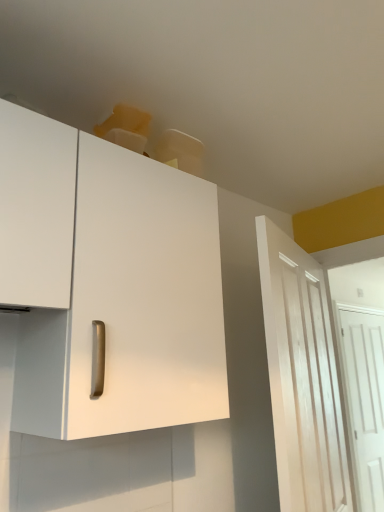
Question: From a real-world perspective, is white matte cabinet at upper left on top of white wooden door at right, which is the 2th door from front to back?

Choices:
 (A) yes
 (B) no

Answer: (A)

Question: Does white matte cabinet at upper left have a greater height compared to white wooden door at right, which is counted as the 1th door, starting from the back?

Choices:
 (A) yes
 (B) no

Answer: (B)

Question: Is white wooden door at right, the second door viewed from the left, at the back of white matte cabinet at upper left?

Choices:
 (A) yes
 (B) no

Answer: (B)

Question: Is white matte cabinet at upper left beside white wooden door at right, which is counted as the 1th door, starting from the back?

Choices:
 (A) no
 (B) yes

Answer: (A)

Question: Considering the relative sizes of white matte cabinet at upper left and white wooden door at right, which is counted as the 1th door, starting from the back, in the image provided, is white matte cabinet at upper left thinner than white wooden door at right, which is counted as the 1th door, starting from the back,?

Choices:
 (A) no
 (B) yes

Answer: (A)

Question: Based on their positions, is white wooden door at right, which is counted as the 1th door, starting from the back, located to the left or right of white wood door at right, the 1th door when ordered from front to back?

Choices:
 (A) left
 (B) right

Answer: (B)

Question: Looking at their shapes, would you say white wooden door at right, which is counted as the 1th door, starting from the back, is wider or thinner than white wood door at right, the 1th door when ordered from front to back?

Choices:
 (A) wide
 (B) thin

Answer: (B)

Question: Is point (375, 385) positioned closer to the camera than point (292, 307)?

Choices:
 (A) farther
 (B) closer

Answer: (A)

Question: Is white wooden door at right, which is counted as the 1th door, starting from the back, inside or outside of white wood door at right, which ranks as the 1th door in left-to-right order?

Choices:
 (A) outside
 (B) inside

Answer: (A)

Question: In terms of size, does white wood door at right, which is counted as the 2th door, starting from the back, appear bigger or smaller than white matte cabinet at upper left?

Choices:
 (A) small
 (B) big

Answer: (A)

Question: From a real-world perspective, is white wood door at right, marked as the 2th door in a right-to-left arrangement, physically located above or below white matte cabinet at upper left?

Choices:
 (A) above
 (B) below

Answer: (B)

Question: In the image, is white wood door at right, which ranks as the 1th door in left-to-right order, positioned in front of or behind white matte cabinet at upper left?

Choices:
 (A) behind
 (B) front

Answer: (A)

Question: From the image's perspective, is white wood door at right, which is counted as the 2th door, starting from the back, positioned above or below white matte cabinet at upper left?

Choices:
 (A) below
 (B) above

Answer: (A)

Question: In the image, is white wood door at right, which is counted as the 2th door, starting from the back, on the left side or the right side of white wooden door at right, which is counted as the 1th door, starting from the back?

Choices:
 (A) right
 (B) left

Answer: (B)

Question: Is white wood door at right, marked as the 2th door in a right-to-left arrangement, wider or thinner than white wooden door at right, which is counted as the 1th door, starting from the back?

Choices:
 (A) thin
 (B) wide

Answer: (B)